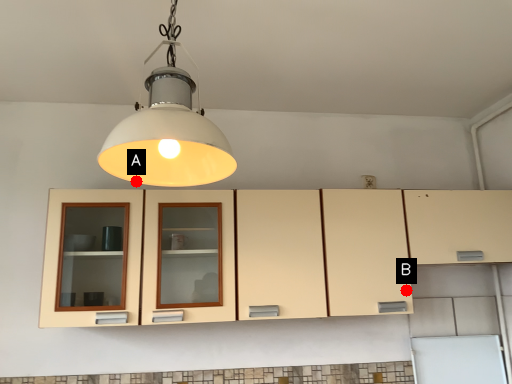
Question: Two points are circled on the image, labeled by A and B beside each circle. Which point is further to the camera?

Choices:
 (A) A is further
 (B) B is further

Answer: (B)